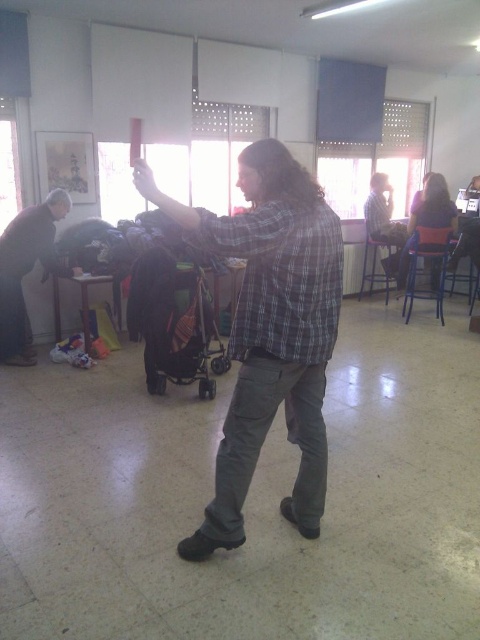
Can you confirm if plaid fabric shirt at center is positioned to the right of blue denim shirt at center?

In fact, plaid fabric shirt at center is to the left of blue denim shirt at center.

Where is `plaid fabric shirt at center`? plaid fabric shirt at center is located at coordinates (269, 332).

You are a GUI agent. You are given a task and a screenshot of the screen. Output one action in this format:
    pyautogui.click(x=<x>, y=<y>)
    Task: Click on the plaid fabric shirt at center
    Image resolution: width=480 pixels, height=640 pixels.
    Given the screenshot: What is the action you would take?
    pyautogui.click(x=269, y=332)

Can you confirm if plaid fabric shirt at center is positioned above dark gray wool sweater at left?

No, plaid fabric shirt at center is not above dark gray wool sweater at left.

Between plaid fabric shirt at center and dark gray wool sweater at left, which one appears on the right side from the viewer's perspective?

plaid fabric shirt at center

Does point (309, 452) lie in front of point (48, 232)?

Yes, it is.

I want to click on plaid fabric shirt at center, so click(269, 332).

Between dark gray wool sweater at left and blue denim shirt at center, which one is positioned lower?

dark gray wool sweater at left is lower down.

Is point (49, 260) behind point (442, 188)?

No, it is in front of (442, 188).

Which is behind, point (6, 305) or point (404, 272)?

Positioned behind is point (404, 272).

Locate an element on the screen. The width and height of the screenshot is (480, 640). dark gray wool sweater at left is located at coordinates (24, 272).